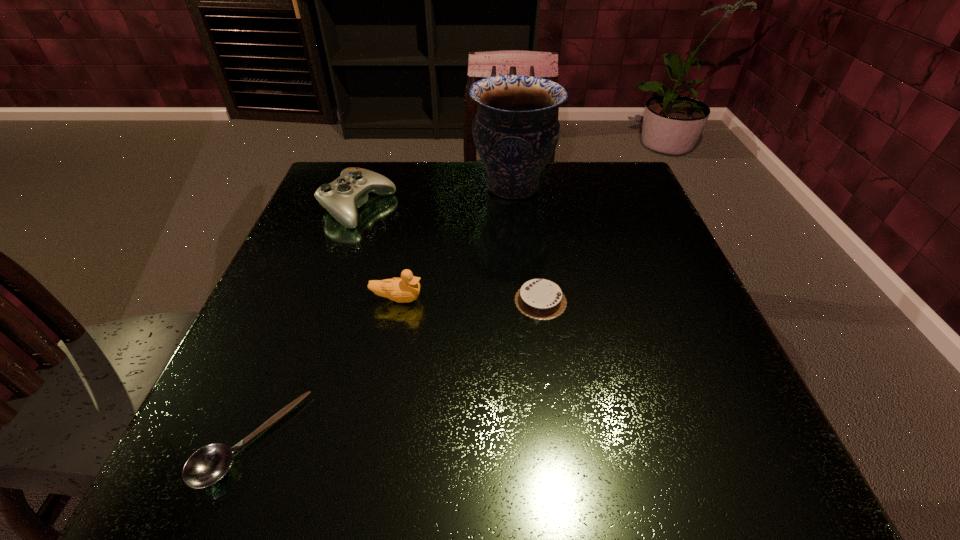
The image size is (960, 540). I want to click on the tallest object, so click(x=515, y=131).

You are a GUI agent. You are given a task and a screenshot of the screen. Output one action in this format:
    pyautogui.click(x=<x>, y=<y>)
    Task: Click on the control
    
    Given the screenshot: What is the action you would take?
    pyautogui.click(x=342, y=197)

The width and height of the screenshot is (960, 540). Find the location of `the third object from left to right`. the third object from left to right is located at coordinates (407, 288).

Identify the location of chocolate cake. The image size is (960, 540). (541, 299).

Locate an element on the screen. This screenshot has height=540, width=960. the nearest object is located at coordinates (209, 464).

The height and width of the screenshot is (540, 960). Find the location of `the shortest object`. the shortest object is located at coordinates [x=209, y=464].

The width and height of the screenshot is (960, 540). Find the location of `blank space located on the front handle of the tallest object`. blank space located on the front handle of the tallest object is located at coordinates (442, 187).

Identify the location of free spot located 0.100m on the front handle of the tallest object. (429, 187).

This screenshot has height=540, width=960. I want to click on blank space located 0.180m on the front handle of the tallest object, so click(396, 187).

The width and height of the screenshot is (960, 540). In order to click on vacant space located 0.070m on the front of the control in this screenshot , I will do `click(342, 253)`.